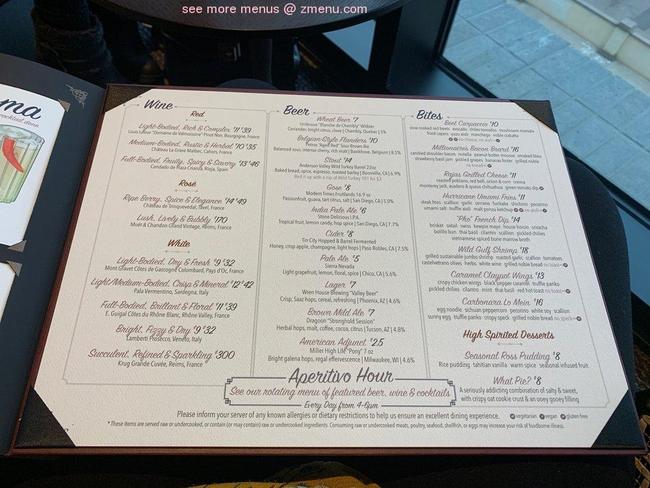
Find the location of `inside ledge of wondow`. inside ledge of wondow is located at coordinates (437, 74).